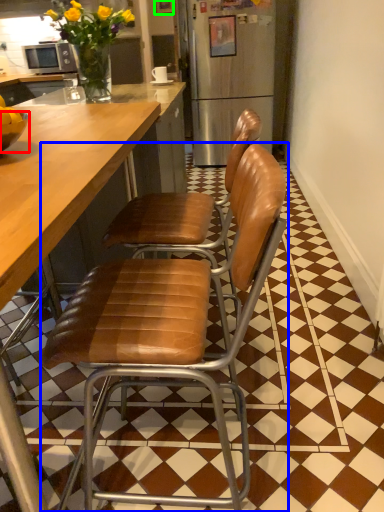
Question: Considering the real-world distances, which object is closest to bowl (highlighted by a red box)? chair (highlighted by a blue box) or picture frame (highlighted by a green box).

Choices:
 (A) chair
 (B) picture frame

Answer: (A)